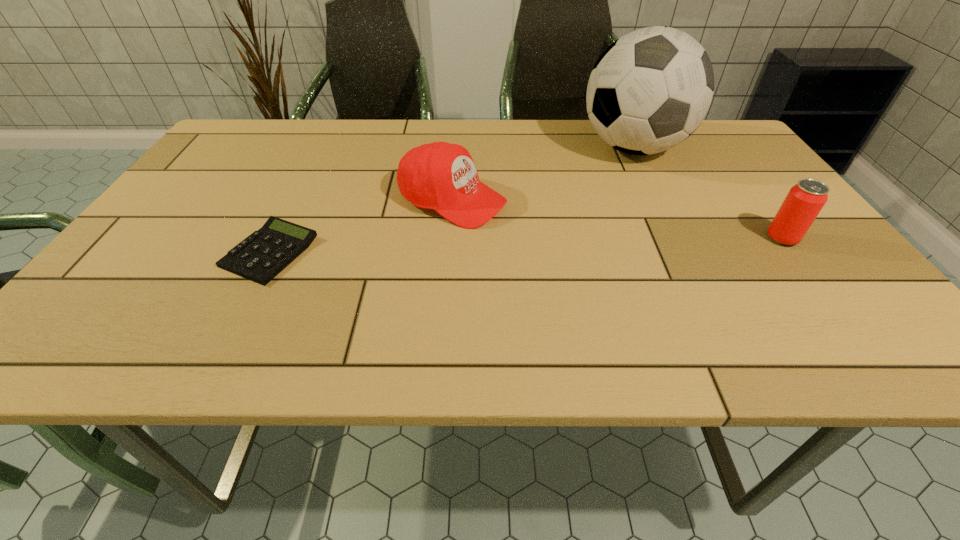
Where is `free region located on the main logo of the third object from left to right`? The width and height of the screenshot is (960, 540). free region located on the main logo of the third object from left to right is located at coordinates (586, 246).

At what (x,y) coordinates should I click in order to perform the action: click on free space located on the front panel of the second object from left to right. Please return your answer as a coordinate pair (x, y). The width and height of the screenshot is (960, 540). Looking at the image, I should click on (666, 279).

Identify the location of vacant space located on the front panel of the second object from left to right. The image size is (960, 540). (651, 273).

This screenshot has height=540, width=960. I want to click on vacant area situated 0.050m on the front panel of the second object from left to right, so click(x=518, y=222).

This screenshot has width=960, height=540. I want to click on object located at the far edge, so click(x=650, y=89).

This screenshot has width=960, height=540. Identify the location of object that is at the near edge. (260, 257).

I want to click on beer can that is at the right edge, so click(804, 201).

The height and width of the screenshot is (540, 960). What are the coordinates of `soccer ball positioned at the right edge` in the screenshot? It's located at (650, 89).

Identify the location of object that is at the far right corner. (650, 89).

This screenshot has height=540, width=960. I want to click on vacant position at the far edge of the desktop, so click(467, 134).